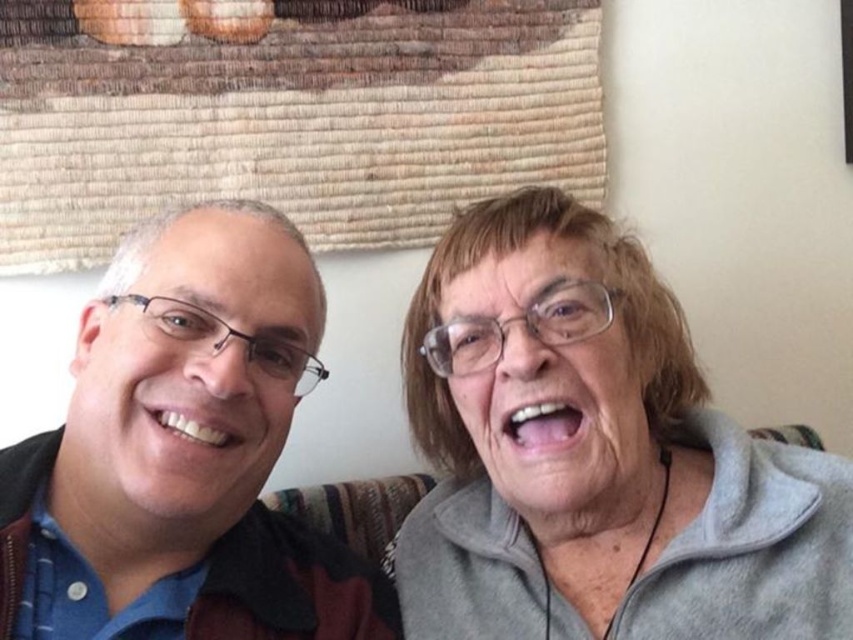
Question: Which point is closer to the camera?

Choices:
 (A) (662, 387)
 (B) (279, 605)

Answer: (B)

Question: Is gray fleece at center bigger than matte black jacket at left?

Choices:
 (A) yes
 (B) no

Answer: (A)

Question: Is gray fleece at center positioned before matte black jacket at left?

Choices:
 (A) yes
 (B) no

Answer: (B)

Question: Which point appears farthest from the camera in this image?

Choices:
 (A) (131, 628)
 (B) (577, 340)

Answer: (B)

Question: Which of the following is the closest to the observer?

Choices:
 (A) matte black jacket at left
 (B) gray fleece at center

Answer: (A)

Question: Is gray fleece at center below matte black jacket at left?

Choices:
 (A) no
 (B) yes

Answer: (B)